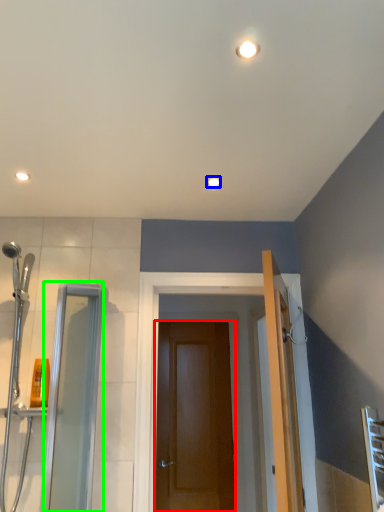
Question: Considering the real-world distances, which object is closest to door (highlighted by a red box)? light fixture (highlighted by a blue box) or screen door (highlighted by a green box).

Choices:
 (A) light fixture
 (B) screen door

Answer: (B)